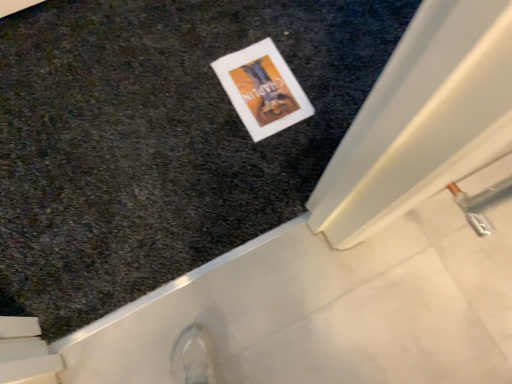
Locate an element on the screen. free space to the back side of white paper at center is located at coordinates (272, 25).